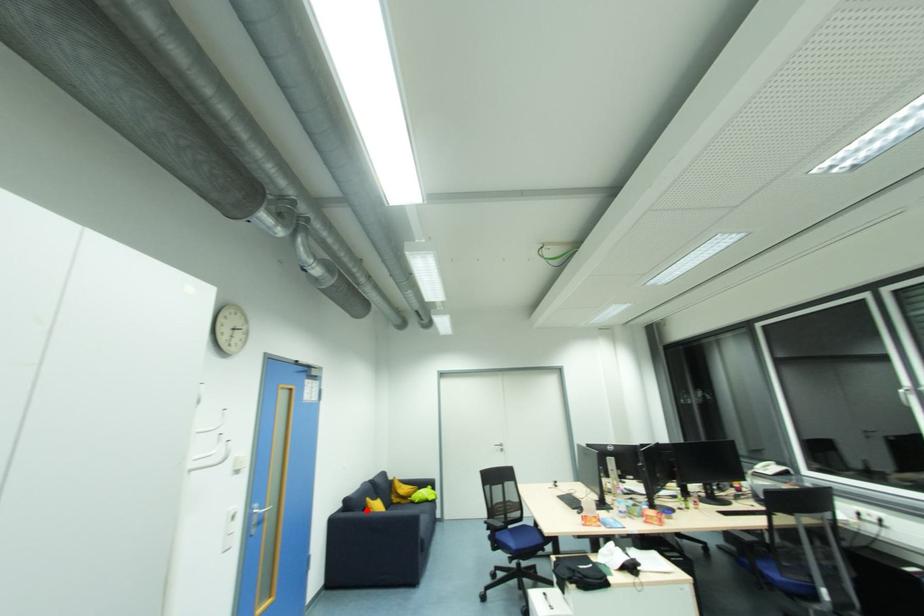
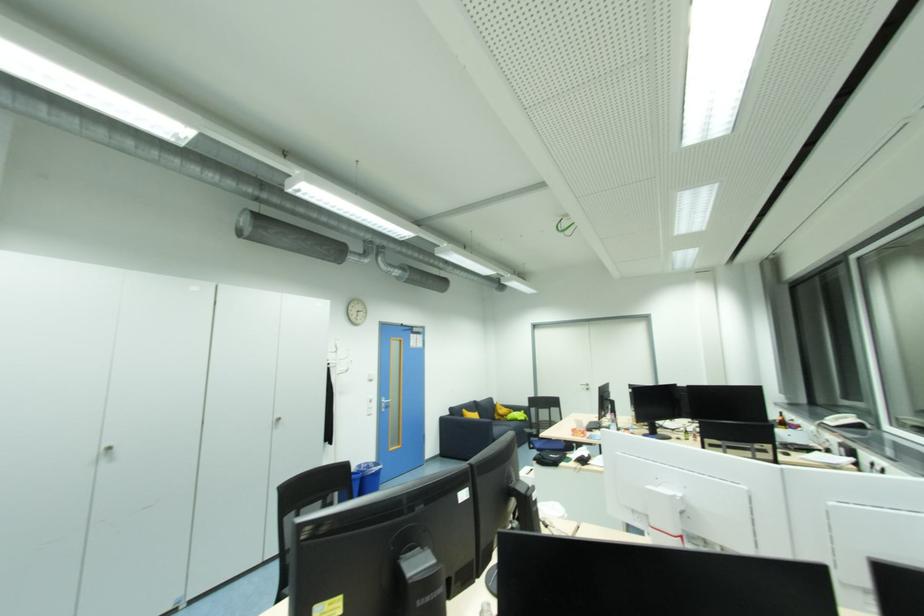
Where in the second image is the point corresponding to the highlighted location from the first image?

(466, 416)